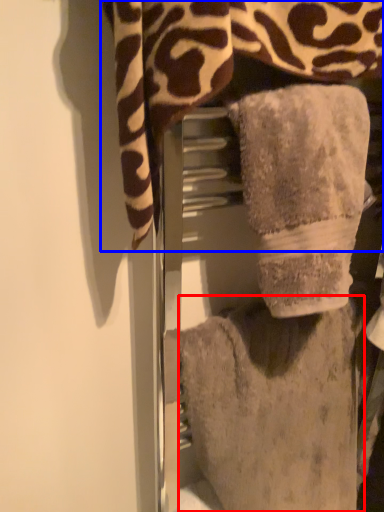
Question: Among these objects, which one is farthest to the camera, towel (highlighted by a red box) or towel (highlighted by a blue box)?

Choices:
 (A) towel
 (B) towel

Answer: (A)